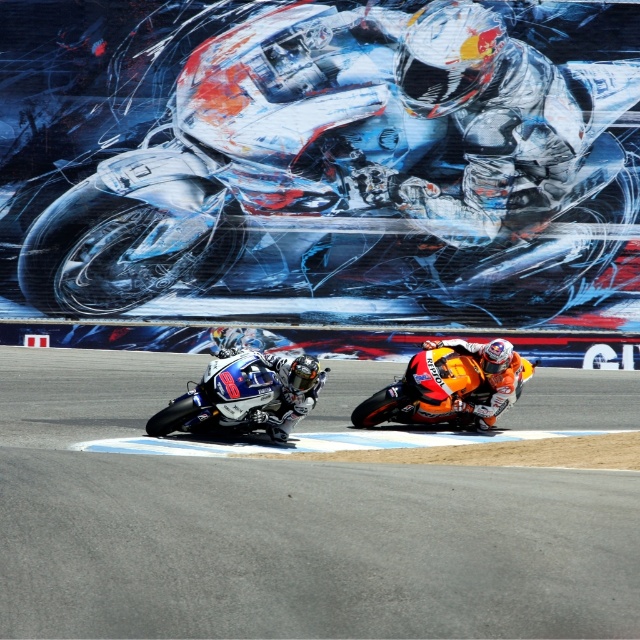
You are a photographer at the motorcycle race. You want to capture a photo of both shiny metallic motorcycle at upper center and shiny metallic motorcycle at lower left in the same frame. Based on their positions, which motorcycle should you adjust your camera angle to include first?

The shiny metallic motorcycle at lower left should be adjusted first because the shiny metallic motorcycle at upper center might be wider and thus requires a wider angle to include both in the frame.

You are a photographer positioned at the side of the track. You want to capture a photo of the shiny metallic motorcycle at upper center and the smooth asphalt track at center. Which object should you focus on first if you want to ensure both are in sharp focus?

The shiny metallic motorcycle at upper center is located above the smooth asphalt track at center. To ensure both are in sharp focus, you should focus on the shiny metallic motorcycle at upper center first since it is farther away and will require a smaller aperture or a higher depth of field to capture both distances clearly.

You are a race official measuring the distance between the two shiny metallic motorcycles. The safety regulations require a minimum distance of 40 feet between competing vehicles during the race. Based on the scene, does the current distance between the shiny metallic motorcycle at upper center and the shiny metallic motorcycle at lower left meet the safety requirement?

The distance between the shiny metallic motorcycle at upper center and the shiny metallic motorcycle at lower left is 40.14 feet, which exceeds the required 40 feet minimum. Therefore, the safety regulations are met.